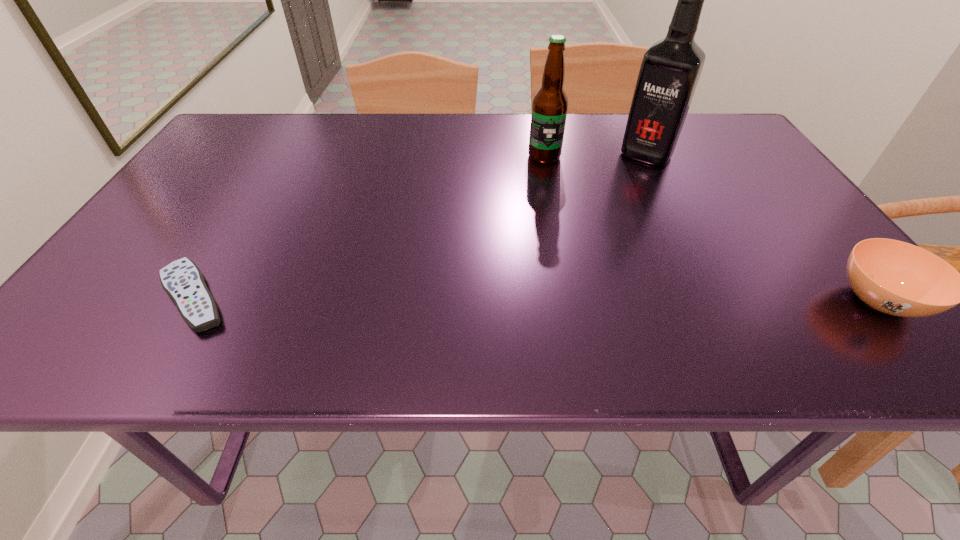
Image resolution: width=960 pixels, height=540 pixels. I want to click on free space on the desktop that is between the leftmost object and the third tallest object and is positioned on the front-facing side of the tallest object, so click(544, 299).

The height and width of the screenshot is (540, 960). Identify the location of free spot on the desktop that is between the shortest object and the rightmost object and is positioned on the label of the third object from right to left. (521, 298).